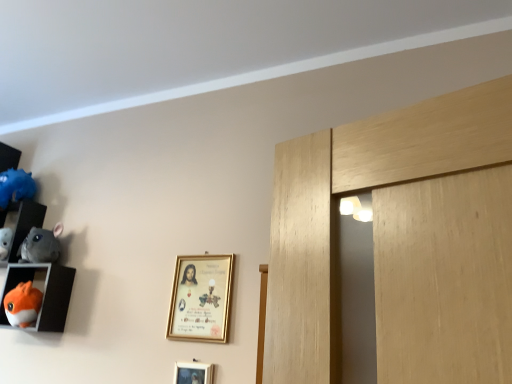
Question: Which is correct: gold metallic picture frame at center, which is counted as the first picture frame, starting from the top, is inside blue fluffy toy at left, which is the 1th toy in top-to-bottom order, or outside of it?

Choices:
 (A) outside
 (B) inside

Answer: (A)

Question: Does point (190, 261) appear closer or farther from the camera than point (14, 180)?

Choices:
 (A) farther
 (B) closer

Answer: (B)

Question: Considering the real-world distances, which object is closest to the orange plush toy at left, the 2th shelf positioned from the top?

Choices:
 (A) matte plastic shelf at left, the 2th shelf in the bottom-to-top sequence
 (B) blue fluffy toy at left, which is the 1th toy in top-to-bottom order
 (C) gold metallic picture frame at center, acting as the second picture frame starting from the bottom
 (D) gray plush chinchilla at left, which ranks as the 2th toy in top-to-bottom order
 (E) orange plush toy at lower left, placed as the first toy when sorted from bottom to top

Answer: (E)

Question: Which object is the farthest from the orange plush toy at lower left, marked as the 3th toy in a top-to-bottom arrangement?

Choices:
 (A) matte plastic shelf at left, which ranks as the 1th shelf in top-to-bottom order
 (B) blue fluffy toy at left, which appears as the 3th toy when ordered from the bottom
 (C) orange plush toy at left, positioned as the first shelf in bottom-to-top order
 (D) gold metallic picture frame at center, acting as the second picture frame starting from the bottom
 (E) gold metallic picture frame at lower center, placed as the first picture frame when sorted from bottom to top

Answer: (E)